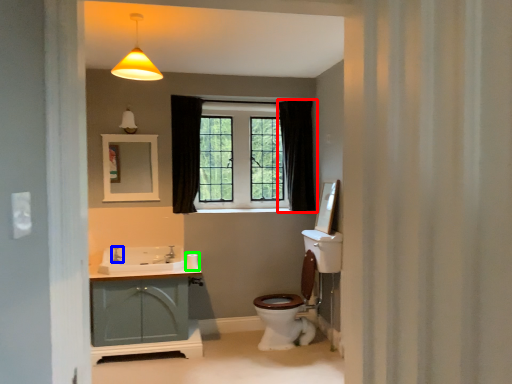
Question: Which is farther away from curtain (highlighted by a red box)? faucet (highlighted by a blue box) or toilet paper (highlighted by a green box)?

Choices:
 (A) faucet
 (B) toilet paper

Answer: (A)